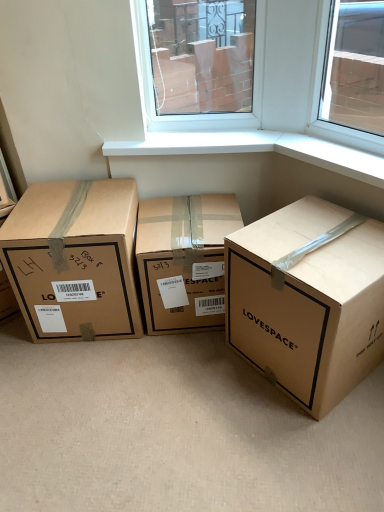
Question: Considering the relative positions of brown cardboard box at left, acting as the first box starting from the left, and brown cardboard box at center, which is counted as the 2th box, starting from the left, in the image provided, is brown cardboard box at left, acting as the first box starting from the left, to the left or to the right of brown cardboard box at center, which is counted as the 2th box, starting from the left,?

Choices:
 (A) right
 (B) left

Answer: (B)

Question: From the image's perspective, is brown cardboard box at left, marked as the third box in a right-to-left arrangement, located above or below brown cardboard box at center, which is counted as the 2th box, starting from the left?

Choices:
 (A) above
 (B) below

Answer: (A)

Question: Estimate the real-world distances between objects in this image. Which object is farther from the brown cardboard box at center, the 2th box from the right?

Choices:
 (A) brown cardboard box at center, acting as the first box starting from the right
 (B) brown cardboard box at left, acting as the first box starting from the left

Answer: (A)

Question: Which is farther from the brown cardboard box at center, which is counted as the 2th box, starting from the left?

Choices:
 (A) brown cardboard box at center, acting as the first box starting from the right
 (B) brown cardboard box at left, acting as the first box starting from the left

Answer: (A)